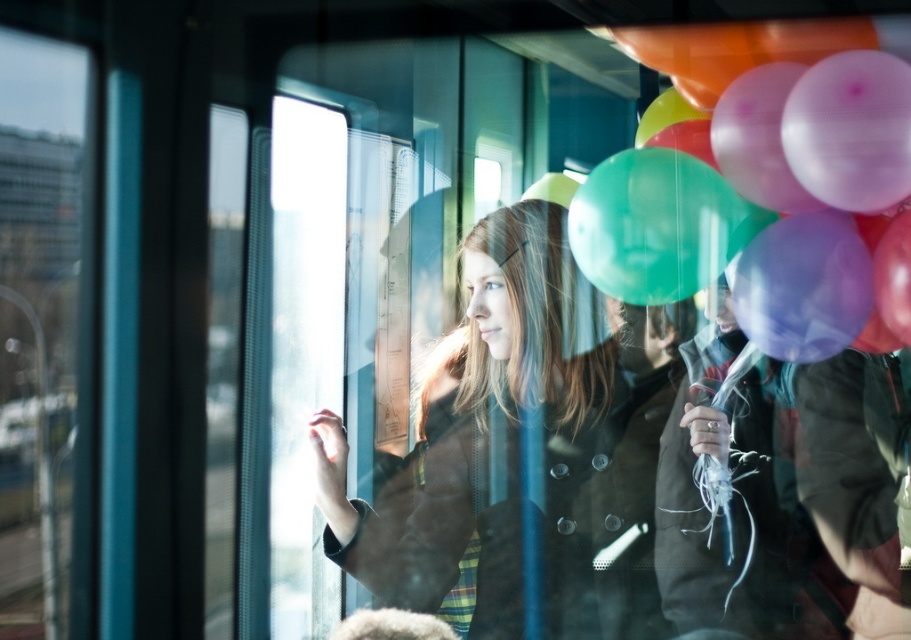
Can you confirm if matte brown coat at center is thinner than translucent rubber balloons at upper right?

No, matte brown coat at center is not thinner than translucent rubber balloons at upper right.

Where is `matte brown coat at center`? matte brown coat at center is located at coordinates (492, 445).

Which is in front, point (571, 332) or point (827, 154)?

Point (827, 154) is more forward.

Find the location of a particular element. matte brown coat at center is located at coordinates (492, 445).